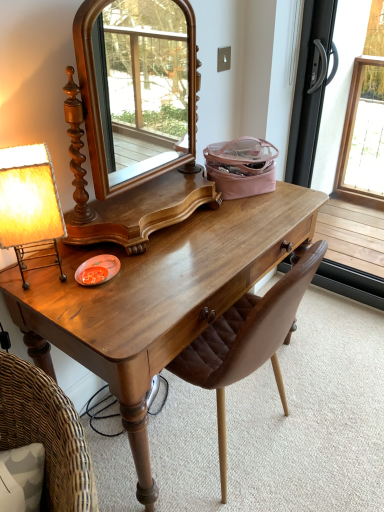
Question: Would you say matte yellow fabric lampshade at left is outside transparent glass screen door at right?

Choices:
 (A) yes
 (B) no

Answer: (A)

Question: From the image's perspective, is matte yellow fabric lampshade at left beneath transparent glass screen door at right?

Choices:
 (A) no
 (B) yes

Answer: (B)

Question: From a real-world perspective, does matte yellow fabric lampshade at left sit lower than transparent glass screen door at right?

Choices:
 (A) yes
 (B) no

Answer: (B)

Question: Is matte yellow fabric lampshade at left at the right side of transparent glass screen door at right?

Choices:
 (A) yes
 (B) no

Answer: (B)

Question: Is matte yellow fabric lampshade at left positioned behind transparent glass screen door at right?

Choices:
 (A) yes
 (B) no

Answer: (B)

Question: Considering the positions of matte yellow fabric lampshade at left and transparent glass screen door at right in the image, is matte yellow fabric lampshade at left wider or thinner than transparent glass screen door at right?

Choices:
 (A) thin
 (B) wide

Answer: (B)

Question: Visually, is matte yellow fabric lampshade at left positioned to the left or to the right of transparent glass screen door at right?

Choices:
 (A) right
 (B) left

Answer: (B)

Question: Considering the positions of matte yellow fabric lampshade at left and transparent glass screen door at right in the image, is matte yellow fabric lampshade at left bigger or smaller than transparent glass screen door at right?

Choices:
 (A) small
 (B) big

Answer: (A)

Question: In the image, is matte yellow fabric lampshade at left positioned in front of or behind transparent glass screen door at right?

Choices:
 (A) behind
 (B) front

Answer: (B)

Question: Is matte yellow fabric lampshade at left inside or outside of shiny brown wooden desk at center?

Choices:
 (A) outside
 (B) inside

Answer: (A)

Question: Considering the positions of matte yellow fabric lampshade at left and shiny brown wooden desk at center in the image, is matte yellow fabric lampshade at left taller or shorter than shiny brown wooden desk at center?

Choices:
 (A) short
 (B) tall

Answer: (A)

Question: From the image's perspective, is matte yellow fabric lampshade at left above or below shiny brown wooden desk at center?

Choices:
 (A) above
 (B) below

Answer: (A)

Question: Is matte yellow fabric lampshade at left in front of or behind shiny brown wooden desk at center in the image?

Choices:
 (A) behind
 (B) front

Answer: (A)

Question: From a real-world perspective, relative to transparent glass screen door at right, is brown leather chair at center vertically above or below?

Choices:
 (A) below
 (B) above

Answer: (A)

Question: Is brown leather chair at center to the left or to the right of transparent glass screen door at right in the image?

Choices:
 (A) right
 (B) left

Answer: (B)